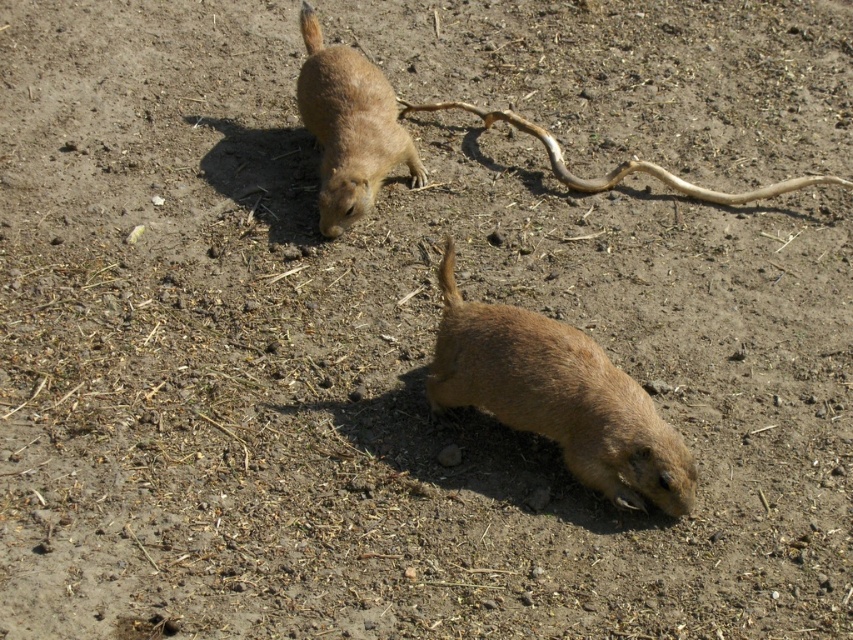
Does brown furry ground squirrel at upper center come in front of brown fur tail at lower center?

No, brown furry ground squirrel at upper center is behind brown fur tail at lower center.

Does point (312, 120) come behind point (447, 260)?

That is True.

The width and height of the screenshot is (853, 640). What are the coordinates of `brown furry ground squirrel at upper center` in the screenshot? It's located at (351, 132).

Does brown furry ground squirrel at lower center lie behind brown fur tail at upper center?

No, brown furry ground squirrel at lower center is in front of brown fur tail at upper center.

Does point (664, 483) come in front of point (306, 33)?

Yes.

Describe the element at coordinates (561, 401) in the screenshot. I see `brown furry ground squirrel at lower center` at that location.

Where is `brown furry ground squirrel at lower center`? The image size is (853, 640). brown furry ground squirrel at lower center is located at coordinates (561, 401).

Find the location of `brown furry ground squirrel at upper center`. brown furry ground squirrel at upper center is located at coordinates (351, 132).

Identify the location of brown furry ground squirrel at upper center. This screenshot has height=640, width=853. (351, 132).